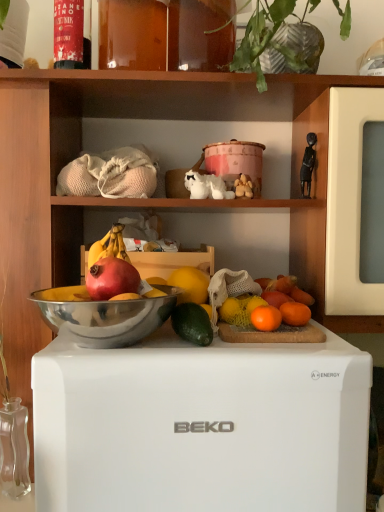
Question: Should I look upward or downward to see white ceramic dog at center?

Choices:
 (A) up
 (B) down

Answer: (A)

Question: Is white matte refrigerator at center not near red matte grapefruit at center, placed as the first grapefruit when sorted from left to right?

Choices:
 (A) no
 (B) yes

Answer: (A)

Question: Is white matte refrigerator at center looking in the opposite direction of red matte grapefruit at center, positioned as the 1th grapefruit in front-to-back order?

Choices:
 (A) yes
 (B) no

Answer: (B)

Question: Does white matte refrigerator at center turn towards red matte grapefruit at center, positioned as the 1th grapefruit in front-to-back order?

Choices:
 (A) no
 (B) yes

Answer: (A)

Question: Is white matte refrigerator at center smaller than red matte grapefruit at center, placed as the first grapefruit when sorted from left to right?

Choices:
 (A) no
 (B) yes

Answer: (A)

Question: From a real-world perspective, is white matte refrigerator at center positioned under red matte grapefruit at center, placed as the first grapefruit when sorted from left to right, based on gravity?

Choices:
 (A) yes
 (B) no

Answer: (A)

Question: Considering the relative positions of white matte refrigerator at center and red matte grapefruit at center, placed as the 3th grapefruit when sorted from back to front, in the image provided, is white matte refrigerator at center to the right of red matte grapefruit at center, placed as the 3th grapefruit when sorted from back to front, from the viewer's perspective?

Choices:
 (A) no
 (B) yes

Answer: (B)

Question: Is the depth of metallic silver bowl at center greater than that of black matte figurine at upper right, which ranks as the first toy in right-to-left order?

Choices:
 (A) yes
 (B) no

Answer: (B)

Question: Can you confirm if metallic silver bowl at center is shorter than black matte figurine at upper right, which ranks as the second toy in left-to-right order?

Choices:
 (A) yes
 (B) no

Answer: (A)

Question: From the image's perspective, is metallic silver bowl at center above black matte figurine at upper right, which ranks as the first toy in right-to-left order?

Choices:
 (A) no
 (B) yes

Answer: (A)

Question: Is metallic silver bowl at center turned away from black matte figurine at upper right, which ranks as the second toy in left-to-right order?

Choices:
 (A) no
 (B) yes

Answer: (A)

Question: Is metallic silver bowl at center oriented towards black matte figurine at upper right, which ranks as the first toy in right-to-left order?

Choices:
 (A) yes
 (B) no

Answer: (B)

Question: Considering the relative sizes of metallic silver bowl at center and black matte figurine at upper right, which ranks as the second toy in left-to-right order, in the image provided, is metallic silver bowl at center bigger than black matte figurine at upper right, which ranks as the second toy in left-to-right order,?

Choices:
 (A) no
 (B) yes

Answer: (B)

Question: Is green leafy plant at upper center positioned in front of green matte avocado at center?

Choices:
 (A) no
 (B) yes

Answer: (A)